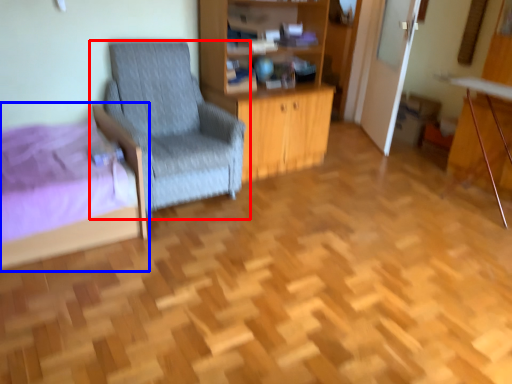
Question: Which object appears closest to the camera in this image, chair (highlighted by a red box) or bed (highlighted by a blue box)?

Choices:
 (A) chair
 (B) bed

Answer: (B)